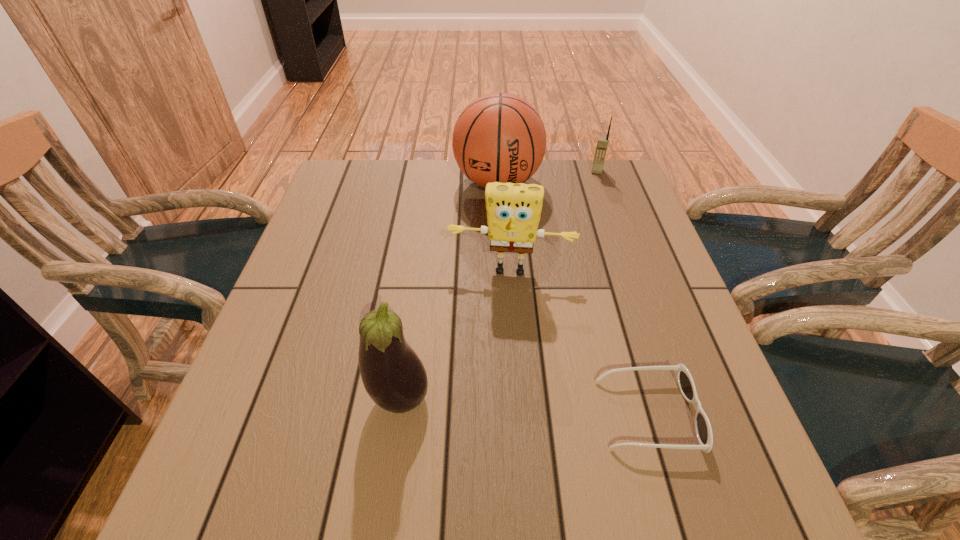
Find the location of a particular element. The image size is (960, 540). object identified as the third closest to the leftmost object is located at coordinates (499, 137).

The height and width of the screenshot is (540, 960). I want to click on vacant space that satisfies the following two spatial constraints: 1. on the back side of the cellular telephone; 2. on the right side of the basketball, so click(497, 171).

Locate an element on the screen. This screenshot has height=540, width=960. free space that satisfies the following two spatial constraints: 1. on the front side of the shortest object; 2. with the lenses of the third farthest object facing outward is located at coordinates (520, 414).

What are the coordinates of `free spot that satisfies the following two spatial constraints: 1. on the front side of the shortest object; 2. with the lenses of the third nearest object facing outward` in the screenshot? It's located at (520, 414).

Where is `free spot that satisfies the following two spatial constraints: 1. on the back side of the basketball; 2. on the left side of the fourth tallest object`? free spot that satisfies the following two spatial constraints: 1. on the back side of the basketball; 2. on the left side of the fourth tallest object is located at coordinates (497, 171).